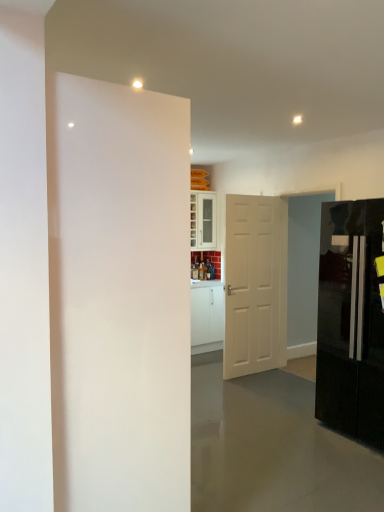
Question: Should I look upward or downward to see glossy black refrigerator at right?

Choices:
 (A) down
 (B) up

Answer: (A)

Question: Is white matte door at center, the second door viewed from the front, outside of white glossy door at left, acting as the 2th door starting from the back?

Choices:
 (A) no
 (B) yes

Answer: (B)

Question: Can you confirm if white matte door at center, which ranks as the 1th door in back-to-front order, is shorter than white glossy door at left, marked as the first door in a left-to-right arrangement?

Choices:
 (A) yes
 (B) no

Answer: (A)

Question: Considering the relative sizes of white matte door at center, which ranks as the 1th door in back-to-front order, and white glossy door at left, marked as the first door in a left-to-right arrangement, in the image provided, is white matte door at center, which ranks as the 1th door in back-to-front order, taller than white glossy door at left, marked as the first door in a left-to-right arrangement,?

Choices:
 (A) no
 (B) yes

Answer: (A)

Question: Is white matte door at center, which is counted as the 2th door, starting from the left, wider than white glossy door at left, marked as the first door in a left-to-right arrangement?

Choices:
 (A) no
 (B) yes

Answer: (A)

Question: Does white matte door at center, acting as the first door starting from the right, have a larger size compared to white glossy door at left, the 1th door in the front-to-back sequence?

Choices:
 (A) no
 (B) yes

Answer: (A)

Question: Is white matte door at center, which is counted as the 2th door, starting from the left, turned away from white glossy door at left, marked as the 2th door in a right-to-left arrangement?

Choices:
 (A) yes
 (B) no

Answer: (B)

Question: From the image's perspective, is white matte door at center, the second door viewed from the front, under glossy black refrigerator at right?

Choices:
 (A) no
 (B) yes

Answer: (A)

Question: From a real-world perspective, is white matte door at center, which is counted as the 2th door, starting from the left, physically above glossy black refrigerator at right?

Choices:
 (A) no
 (B) yes

Answer: (B)

Question: Considering the relative positions of white matte door at center, the second door viewed from the front, and glossy black refrigerator at right in the image provided, is white matte door at center, the second door viewed from the front, to the left of glossy black refrigerator at right from the viewer's perspective?

Choices:
 (A) no
 (B) yes

Answer: (B)

Question: Is white matte door at center, the second door viewed from the front, taller than glossy black refrigerator at right?

Choices:
 (A) no
 (B) yes

Answer: (B)

Question: Is white matte door at center, the second door viewed from the front, turned away from glossy black refrigerator at right?

Choices:
 (A) no
 (B) yes

Answer: (B)

Question: Is white matte door at center, acting as the first door starting from the right, shorter than glossy black refrigerator at right?

Choices:
 (A) yes
 (B) no

Answer: (B)

Question: Considering the relative sizes of white glossy door at left, marked as the first door in a left-to-right arrangement, and glossy black refrigerator at right in the image provided, is white glossy door at left, marked as the first door in a left-to-right arrangement, bigger than glossy black refrigerator at right?

Choices:
 (A) yes
 (B) no

Answer: (B)